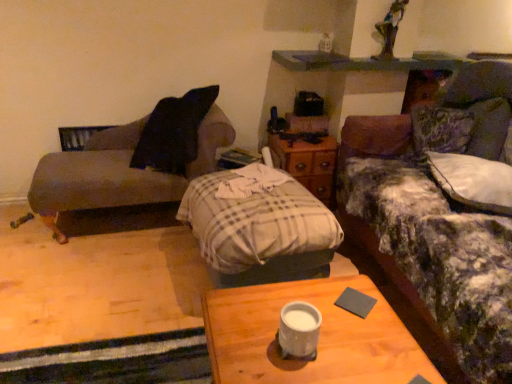
Locate an element on the screen. free spot in front of white matte coffee cup at center is located at coordinates (297, 373).